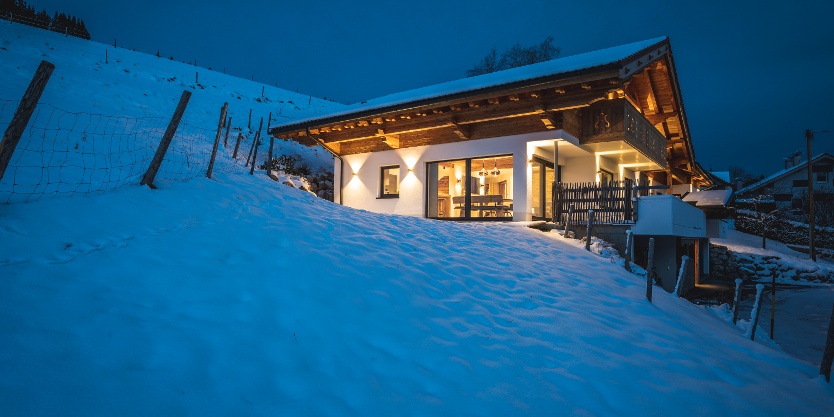
You are a GUI agent. You are given a task and a screenshot of the screen. Output one action in this format:
    pyautogui.click(x=<x>, y=<y>)
    Task: Click on the curtains
    The image size is (834, 417).
    Given the screenshot: What is the action you would take?
    pyautogui.click(x=435, y=197)